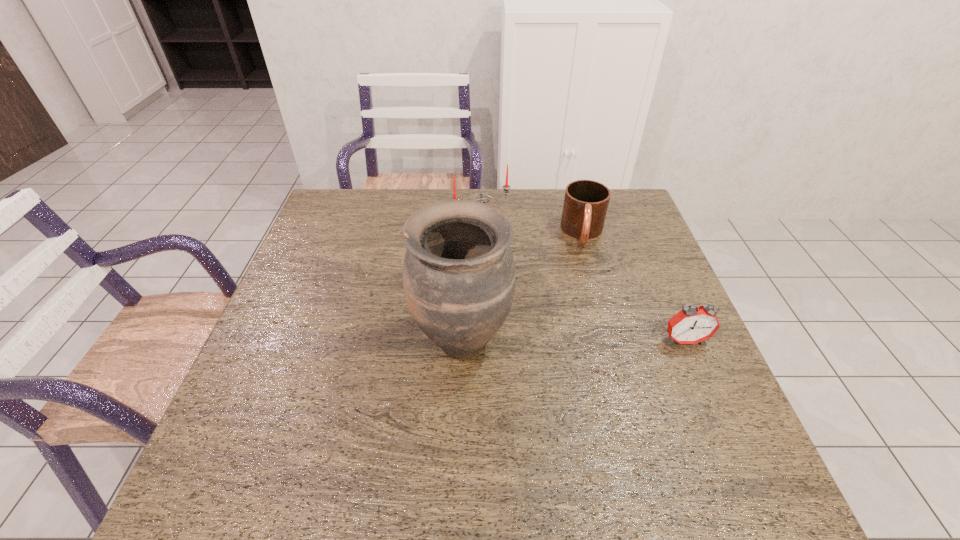
Find the location of `urn`. urn is located at coordinates (459, 275).

You are a GUI agent. You are given a task and a screenshot of the screen. Output one action in this format:
    pyautogui.click(x=<x>, y=<y>)
    Task: Click on the alarm clock
    Image resolution: width=960 pixels, height=540 pixels.
    Given the screenshot: What is the action you would take?
    pyautogui.click(x=691, y=325)

The image size is (960, 540). What are the coordinates of `the third shortest object` in the screenshot? It's located at (506, 187).

Identify the location of mug. This screenshot has height=540, width=960. (585, 206).

At what (x,y) coordinates should I click in order to perform the action: click on blank area located on the left of the tallest object. Please return your answer as a coordinate pair (x, y). Image resolution: width=960 pixels, height=540 pixels. Looking at the image, I should click on (271, 339).

At what (x,y) coordinates should I click in order to perform the action: click on vacant space located 0.160m on the clock face of the rightmost object. Please return your answer as a coordinate pair (x, y). This screenshot has height=540, width=960. Looking at the image, I should click on (714, 410).

Identify the location of vacant space located 0.060m on the front-facing side of the second tallest object. The image size is (960, 540). (502, 245).

The height and width of the screenshot is (540, 960). Identify the location of blank area located on the front-facing side of the second tallest object. (511, 256).

Find the location of a particular element. free point located 0.160m on the front-facing side of the second tallest object is located at coordinates (517, 265).

At what (x,y) coordinates should I click in order to perform the action: click on free space located on the side of the third object from left to right with the handle. Please return your answer as a coordinate pair (x, y). This screenshot has height=540, width=960. Looking at the image, I should click on (586, 282).